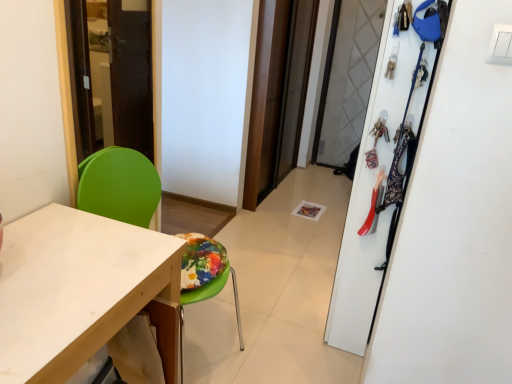
Question: From the image's perspective, relative to transparent glass screen door at center, is green plastic chair at left above or below?

Choices:
 (A) below
 (B) above

Answer: (A)

Question: From a real-world perspective, is green plastic chair at left positioned above or below transparent glass screen door at center?

Choices:
 (A) above
 (B) below

Answer: (B)

Question: Which object is the closest to the white matte desk at lower left?

Choices:
 (A) green plastic chair at left
 (B) transparent glass screen door at center
 (C) white matte closet at upper right

Answer: (A)

Question: Estimate the real-world distances between objects in this image. Which object is farther from the transparent glass screen door at center?

Choices:
 (A) white matte desk at lower left
 (B) green plastic chair at left
 (C) white matte closet at upper right

Answer: (A)